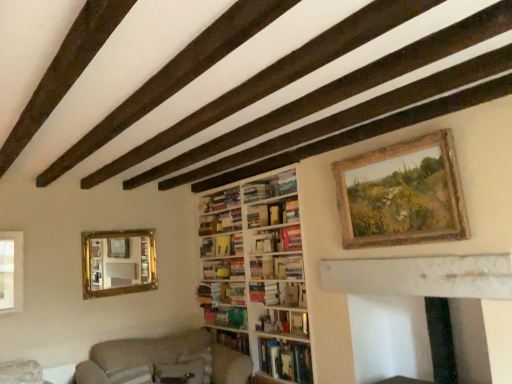
The height and width of the screenshot is (384, 512). Find the location of `free point above wooden rustic frame at upper right (from a real-world perspective)`. free point above wooden rustic frame at upper right (from a real-world perspective) is located at coordinates (399, 142).